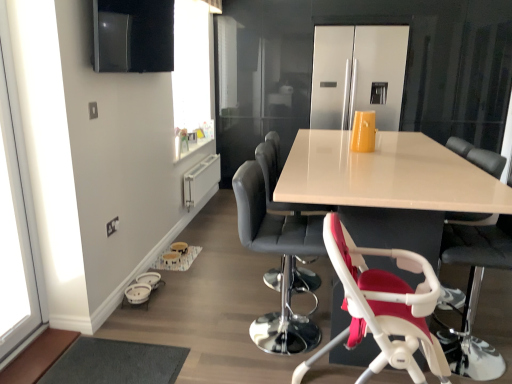
This screenshot has width=512, height=384. Find the location of `empty space that is in between transparent glass window at left and black leather bar stool at center, marked as the 2th chair in a back-to-front arrangement`. empty space that is in between transparent glass window at left and black leather bar stool at center, marked as the 2th chair in a back-to-front arrangement is located at coordinates (161, 343).